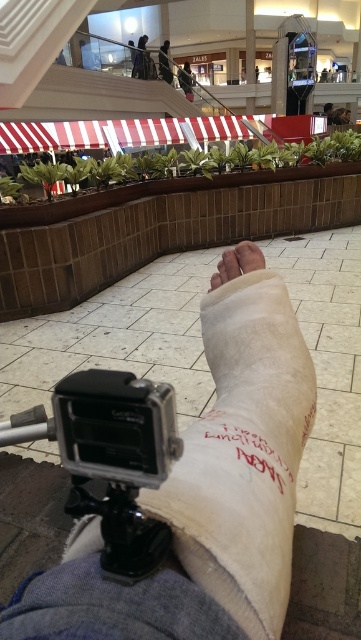
Question: Observing the image, what is the correct spatial positioning of silver metallic action camera at lower center in reference to dark clothing figure at upper center?

Choices:
 (A) above
 (B) below

Answer: (B)

Question: Is silver metallic action camera at lower center behind dark clothing figure at upper center?

Choices:
 (A) no
 (B) yes

Answer: (A)

Question: Can you confirm if white cloth bandage at center is smaller than white bandage at center?

Choices:
 (A) no
 (B) yes

Answer: (A)

Question: Which of the following is the closest to the observer?

Choices:
 (A) (186, 80)
 (B) (253, 257)
 (C) (131, 440)

Answer: (C)

Question: Which point is farther to the camera?

Choices:
 (A) (296, 332)
 (B) (231, 272)
 (C) (188, 92)
 (D) (105, 442)

Answer: (C)

Question: Which point is closer to the camera taking this photo?

Choices:
 (A) (224, 579)
 (B) (166, 54)
 (C) (248, 253)
 (D) (186, 77)

Answer: (A)